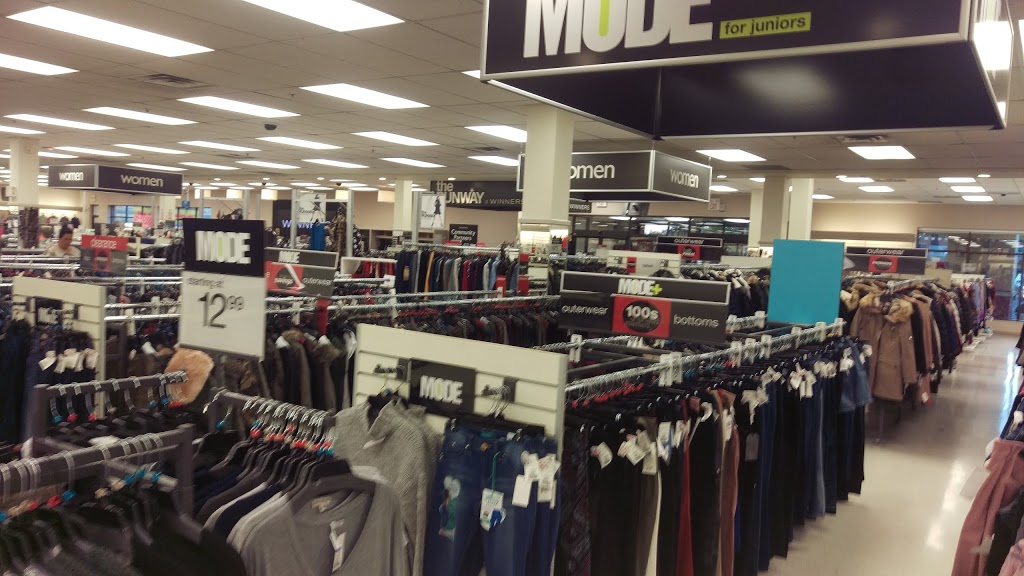
At what (x,y) coordinates should I click in order to perform the action: click on ceiling. Please return your answer as a coordinate pair (x, y). This screenshot has height=576, width=1024. Looking at the image, I should click on (424, 71).